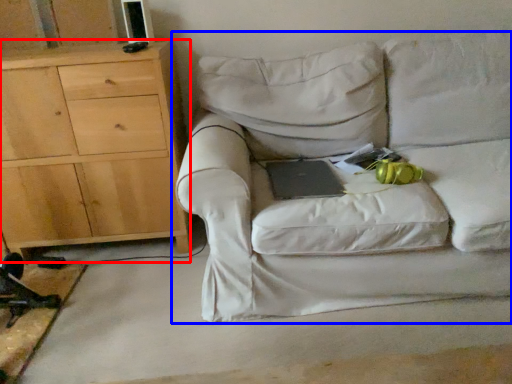
Question: Which object appears farthest to the camera in this image, chest of drawers (highlighted by a red box) or studio couch (highlighted by a blue box)?

Choices:
 (A) chest of drawers
 (B) studio couch

Answer: (A)